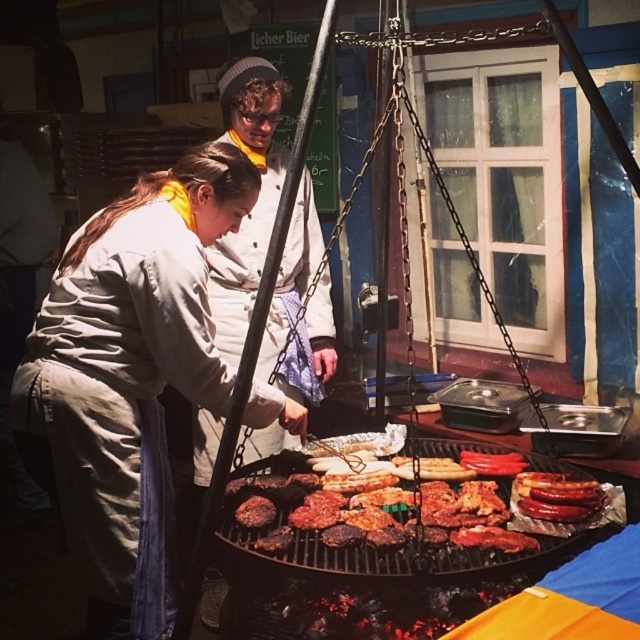
Question: Is matte white apron at center positioned at the back of charred meat at center?

Choices:
 (A) yes
 (B) no

Answer: (B)

Question: Among these objects, which one is nearest to the camera?

Choices:
 (A) matte white apron at center
 (B) charred meat at center

Answer: (A)

Question: Does matte white apron at center have a greater width compared to charred meat at center?

Choices:
 (A) no
 (B) yes

Answer: (A)

Question: Which of the following is the farthest from the observer?

Choices:
 (A) charred meat at center
 (B) matte white apron at center

Answer: (A)

Question: Does matte white apron at center have a lesser width compared to charred meat at center?

Choices:
 (A) yes
 (B) no

Answer: (A)